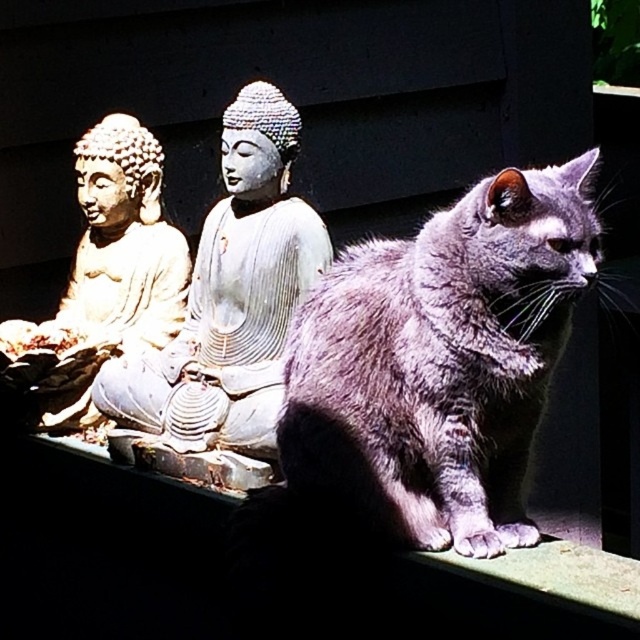
Question: Which point is closer to the camera?

Choices:
 (A) gray stone buddha at center
 (B) satin gray cat at center
 (C) matte gold statue at left

Answer: (B)

Question: Which point appears farthest from the camera in this image?

Choices:
 (A) (168, 433)
 (B) (134, 257)

Answer: (B)

Question: Estimate the real-world distances between objects in this image. Which object is closer to the satin gray cat at center?

Choices:
 (A) gray stone buddha at center
 (B) matte gold statue at left

Answer: (A)

Question: Is satin gray cat at center below gray stone buddha at center?

Choices:
 (A) no
 (B) yes

Answer: (B)

Question: Observing the image, what is the correct spatial positioning of gray stone buddha at center in reference to matte gold statue at left?

Choices:
 (A) right
 (B) left

Answer: (A)

Question: In this image, where is gray stone buddha at center located relative to matte gold statue at left?

Choices:
 (A) below
 (B) above

Answer: (A)